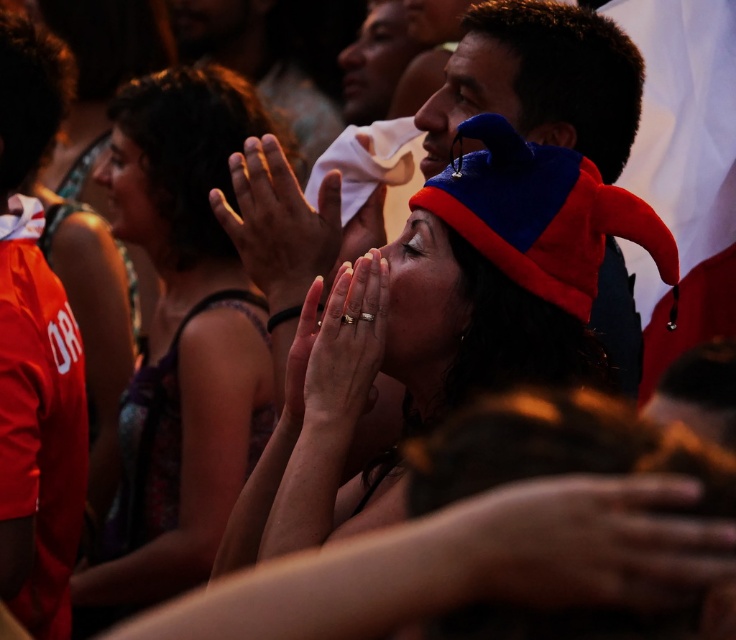
Question: Does smooth skin hand at center have a larger size compared to blue fleece hat at upper center?

Choices:
 (A) no
 (B) yes

Answer: (A)

Question: Observing the image, what is the correct spatial positioning of matte blue hat at center in reference to matte black face at upper center?

Choices:
 (A) left
 (B) right

Answer: (B)

Question: Is gold metallic ring at center above matte black face at upper center?

Choices:
 (A) yes
 (B) no

Answer: (B)

Question: Among these objects, which one is nearest to the camera?

Choices:
 (A) smooth skin hand at center
 (B) blue fleece hat at upper center
 (C) matte blue hat at center
 (D) smooth skin face at center

Answer: (C)

Question: Estimate the real-world distances between objects in this image. Which object is farther from the smooth skin hand at center?

Choices:
 (A) gold metallic ring at center
 (B) matte black face at upper center

Answer: (B)

Question: Among these objects, which one is farthest from the camera?

Choices:
 (A) matte black dress at center
 (B) smooth skin hand at center

Answer: (A)